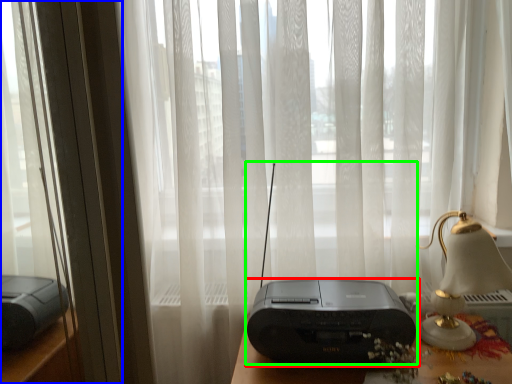
Question: Which object is positioned farthest from printer (highlighted by a red box)? Select from window frame (highlighted by a blue box) and gadget (highlighted by a green box).

Choices:
 (A) window frame
 (B) gadget

Answer: (A)